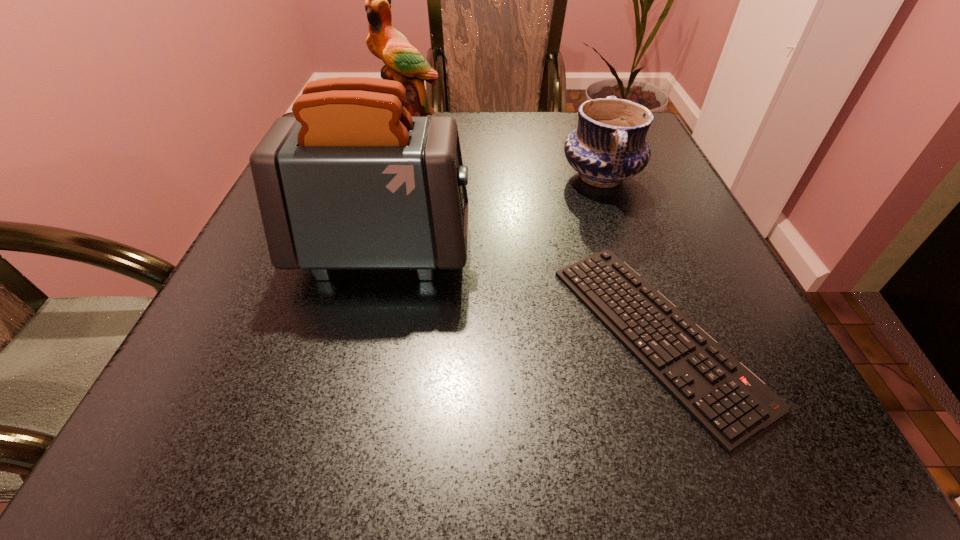
Locate an element on the screen. vacant space at the near edge of the desktop is located at coordinates (425, 456).

Locate an element on the screen. blank space at the left edge is located at coordinates (260, 228).

Identify the location of vacant space at the right edge of the desktop. The width and height of the screenshot is (960, 540). (651, 219).

Find the location of a particular element. Image resolution: width=960 pixels, height=540 pixels. vacant space at the far right corner is located at coordinates (646, 139).

Locate an element on the screen. Image resolution: width=960 pixels, height=540 pixels. free region at the near right corner of the desktop is located at coordinates (684, 412).

Find the location of a particular element. free space between the pottery and the shortest object is located at coordinates (629, 255).

This screenshot has height=540, width=960. In order to click on unoccupied position between the farthest object and the pottery in this screenshot , I will do `click(505, 151)`.

At what (x,y) coordinates should I click in order to perform the action: click on vacant space that's between the toaster and the computer keyboard. Please return your answer as a coordinate pair (x, y). The image size is (960, 540). Looking at the image, I should click on (519, 292).

Locate an element on the screen. This screenshot has height=540, width=960. free area in between the parrot and the shortest object is located at coordinates (532, 230).

The height and width of the screenshot is (540, 960). What are the coordinates of `empty space that is in between the farthest object and the pottery` in the screenshot? It's located at (505, 151).